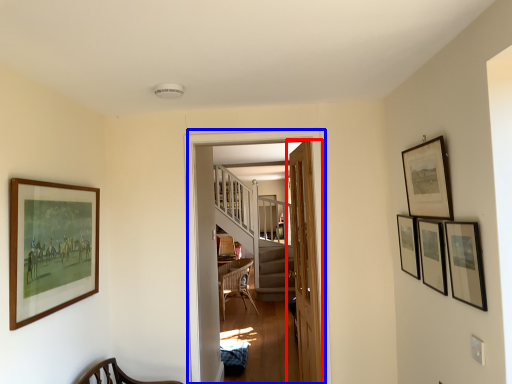
Question: Which object appears closest to the camera in this image, door (highlighted by a red box) or corridor (highlighted by a blue box)?

Choices:
 (A) door
 (B) corridor

Answer: (B)